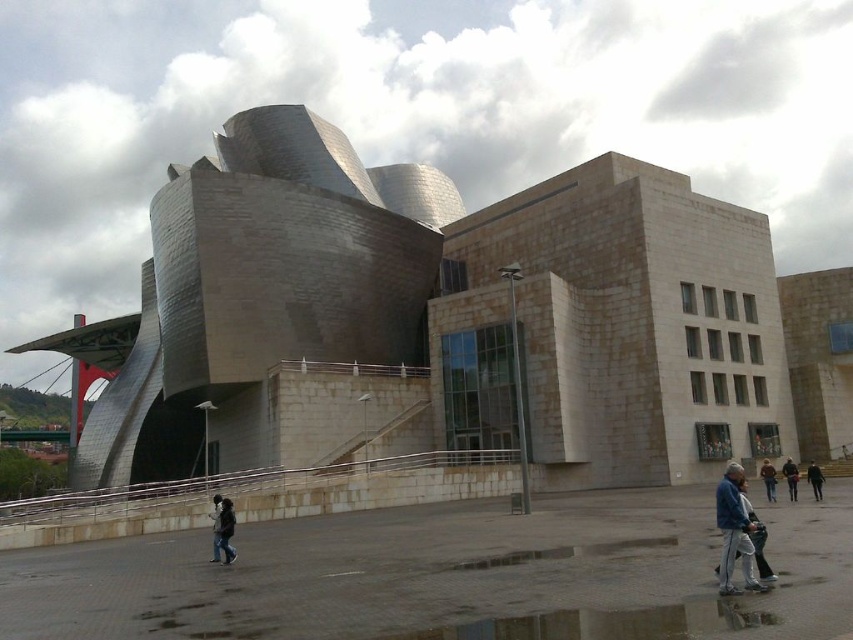
You are standing in front of the Guggenheim Museum Bilbao and want to take a photo. You notice two points marked on the ground in the plaza area. The first point is at coordinates point (x=746, y=532) and the second is at point (x=811, y=490). Which point should you stand closer to if you want to ensure your reflection appears in the wet ground reflection of the museum?

You should stand closer to point (x=746, y=532) because it is closer to the camera than point (x=811, y=490), which means it is nearer to your position, increasing the likelihood of your reflection appearing in the wet ground reflection.

You are standing at the Guggenheim Museum Bilbao and notice a glossy concrete puddle at lower center and a black leather jacket at lower right. Which object is shorter in height?

The glossy concrete puddle at lower center is shorter in height compared to the black leather jacket at lower right.